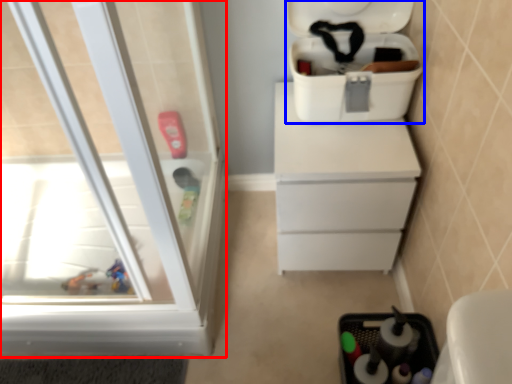
Question: Among these objects, which one is nearest to the camera, screen door (highlighted by a red box) or cooler (highlighted by a blue box)?

Choices:
 (A) screen door
 (B) cooler

Answer: (A)